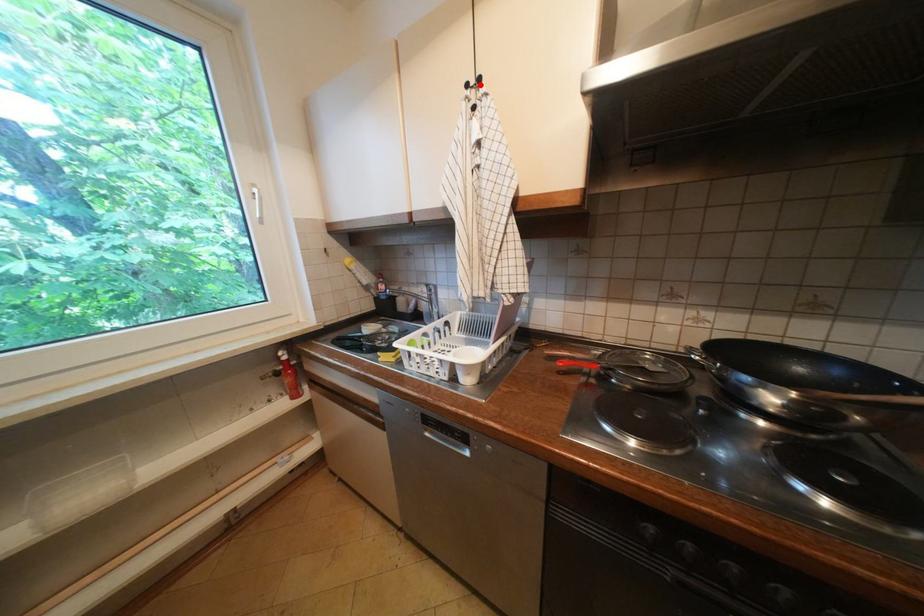
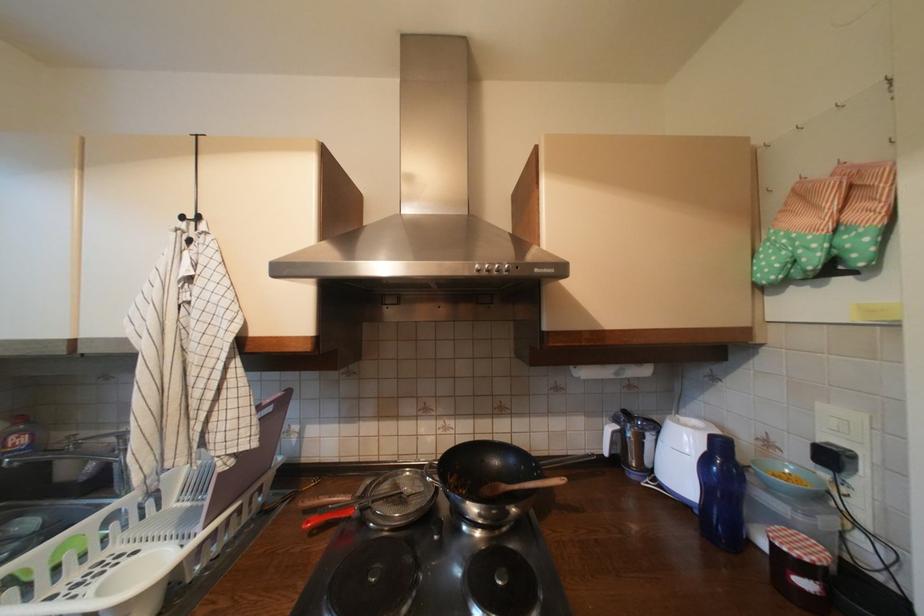
The point at the highlighted location is marked in the first image. Where is the corresponding point in the second image?

(197, 219)